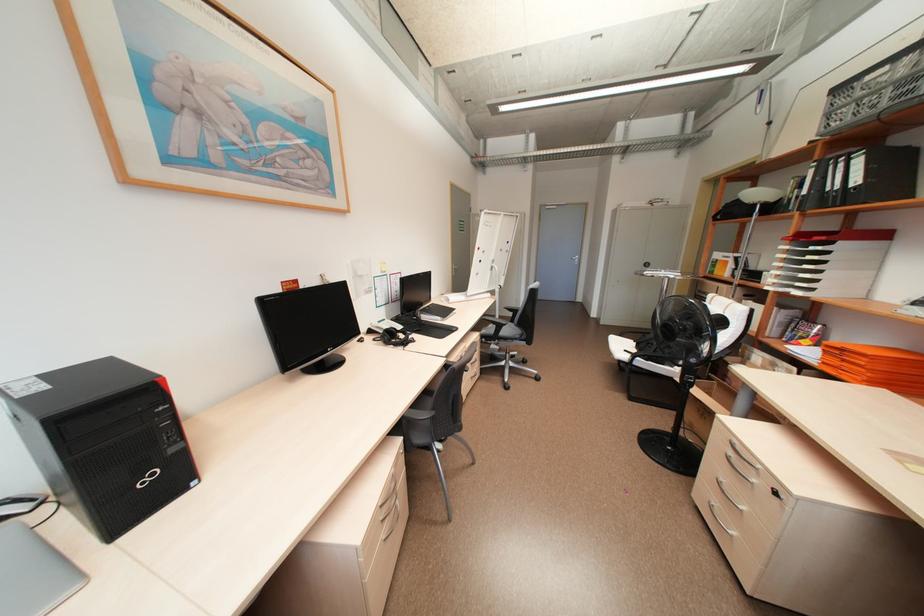
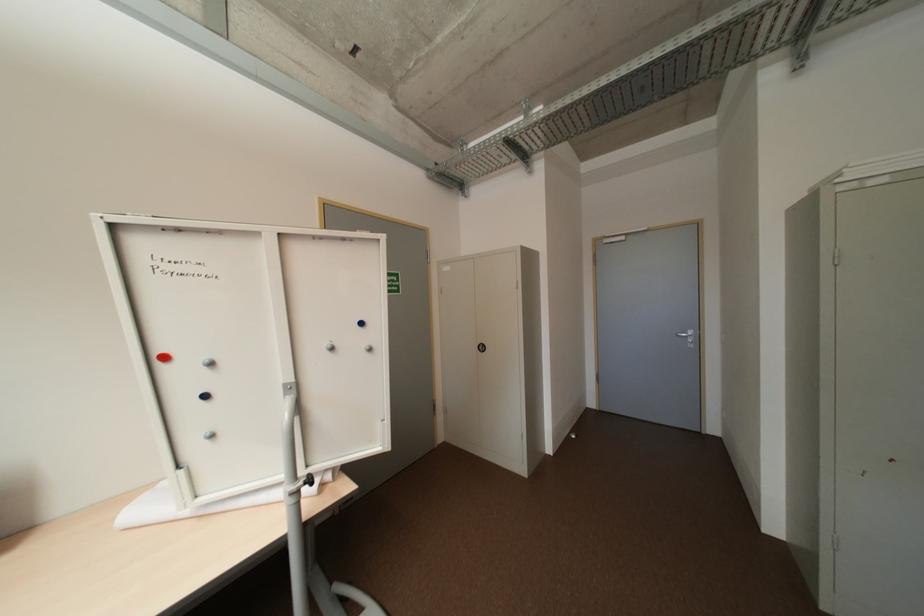
Consider the image. The images are taken continuously from a first-person perspective. In which direction are you moving?

The cameraman walked toward right, forward.